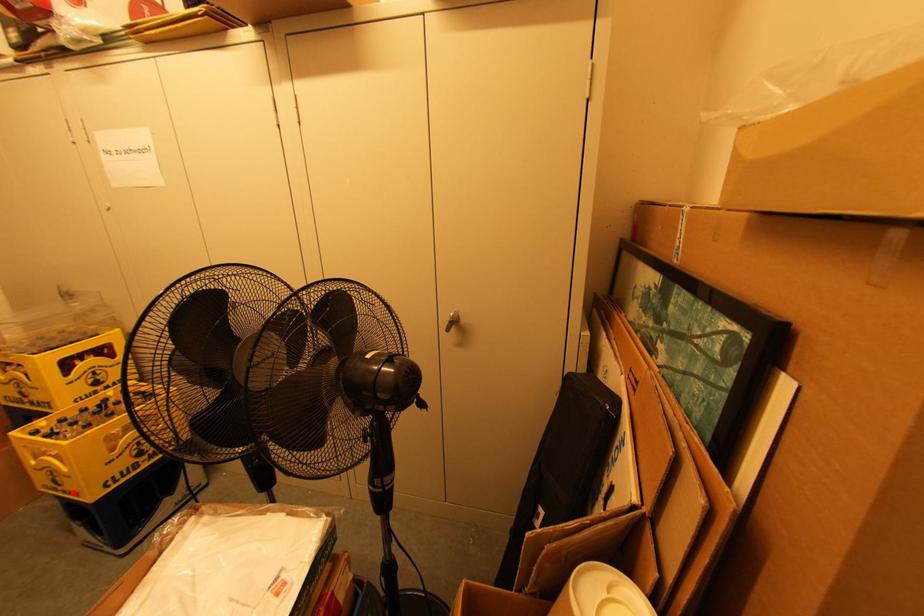
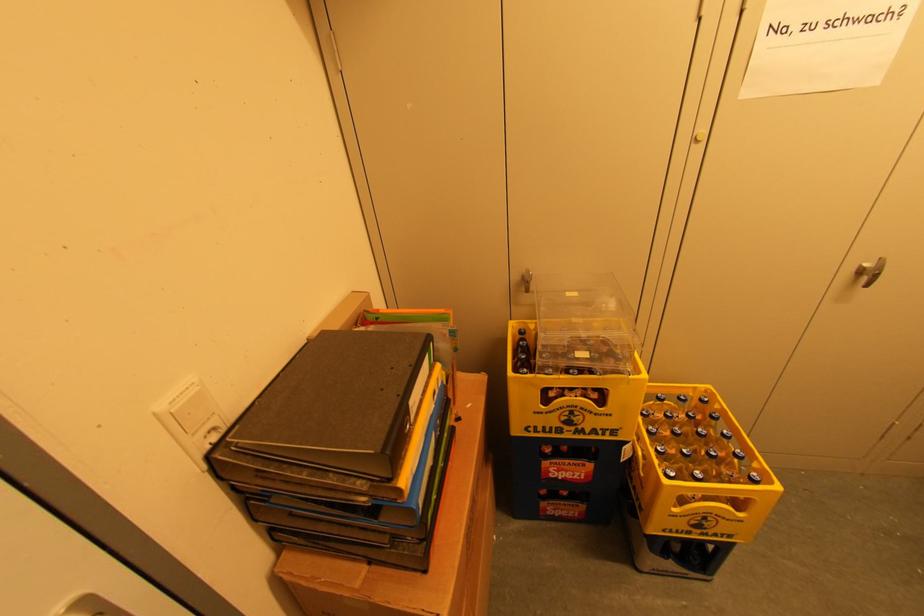
The point at the highlighted location is marked in the first image. Where is the corresponding point in the second image?

(718, 535)